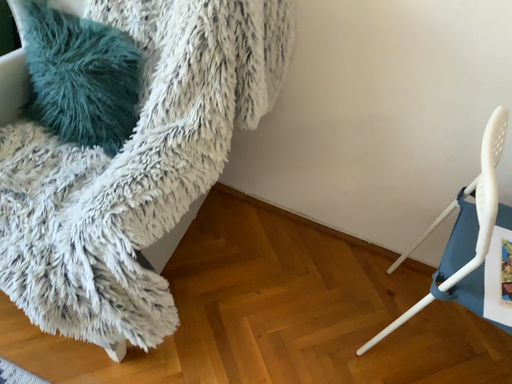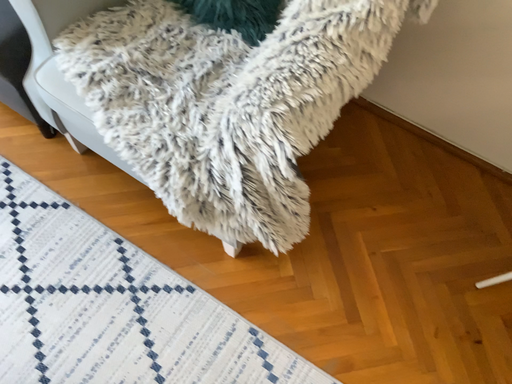
Question: How did the camera likely rotate when shooting the video?

Choices:
 (A) rotated left
 (B) rotated right

Answer: (A)